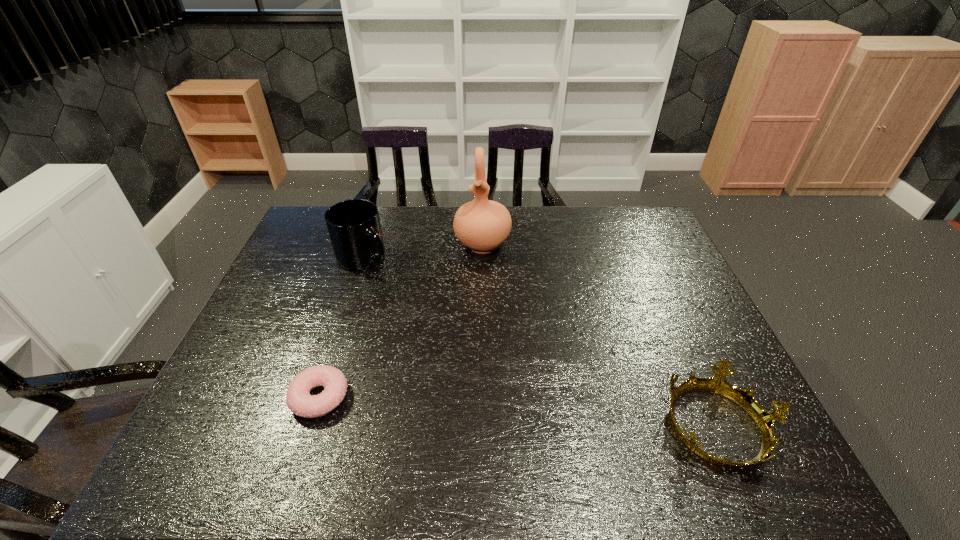
Identify the location of free space at the far edge of the desktop. Image resolution: width=960 pixels, height=540 pixels. pyautogui.click(x=446, y=233).

The height and width of the screenshot is (540, 960). I want to click on vacant space at the near edge of the desktop, so click(x=676, y=413).

At what (x,y) coordinates should I click in order to perform the action: click on vacant space at the left edge. Please return your answer as a coordinate pair (x, y). This screenshot has height=540, width=960. Looking at the image, I should click on (269, 318).

The width and height of the screenshot is (960, 540). I want to click on vacant space at the right edge of the desktop, so click(x=637, y=246).

Find the location of a particular element. free spot at the far right corner of the desktop is located at coordinates [x=647, y=231].

The height and width of the screenshot is (540, 960). I want to click on free point between the second object from right to left and the crown, so click(600, 335).

Where is `empty space that is in between the pottery and the second shortest object`? empty space that is in between the pottery and the second shortest object is located at coordinates click(x=600, y=335).

Identify the location of free space that is in between the third object from left to right and the mug. The height and width of the screenshot is (540, 960). (423, 251).

This screenshot has height=540, width=960. I want to click on unoccupied area between the rightmost object and the mug, so click(x=541, y=342).

The width and height of the screenshot is (960, 540). Find the location of `free space between the shortest object and the mug`. free space between the shortest object and the mug is located at coordinates [x=342, y=327].